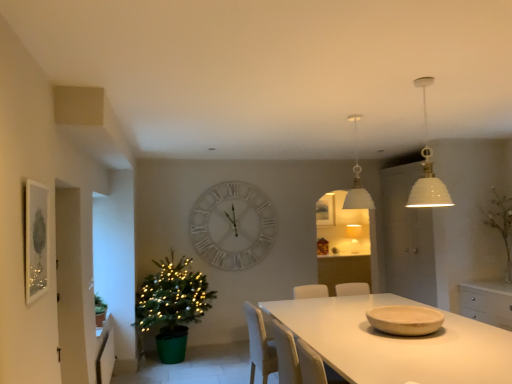
Question: Is point (355, 127) closer or farther from the camera than point (359, 304)?

Choices:
 (A) closer
 (B) farther

Answer: (B)

Question: Is white matte pendant light at upper center, acting as the second lamp starting from the front, inside or outside of white matte table at center?

Choices:
 (A) inside
 (B) outside

Answer: (B)

Question: Which object is positioned farthest from the green matte christmas tree at lower left?

Choices:
 (A) white matte clock at center
 (B) matte silver picture frame at left, which is the 2th picture frame from right to left
 (C) white matte table at center
 (D) matte white picture frame at center, placed as the first picture frame when sorted from right to left
 (E) white ceramic lampshade at upper right, which is the first lamp from front to back

Answer: (E)

Question: Considering the real-world distances, which object is closest to the green matte christmas tree at lower left?

Choices:
 (A) white matte table at center
 (B) white ceramic lampshade at upper right, which is the first lamp from front to back
 (C) matte white picture frame at center, placed as the first picture frame when sorted from right to left
 (D) white matte clock at center
 (E) white matte pendant light at upper center, acting as the second lamp starting from the front

Answer: (D)